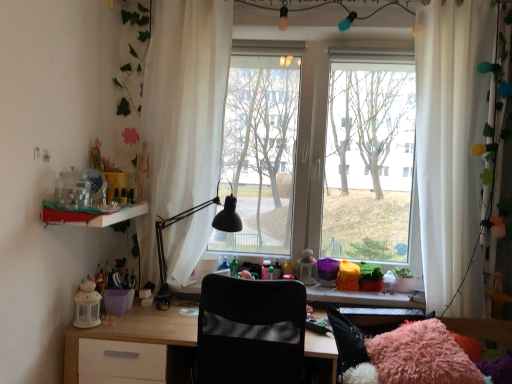
Locate an element on the screen. This screenshot has width=512, height=384. free space in front of white sheer curtain at center, arranged as the first curtain when viewed from the left is located at coordinates (157, 317).